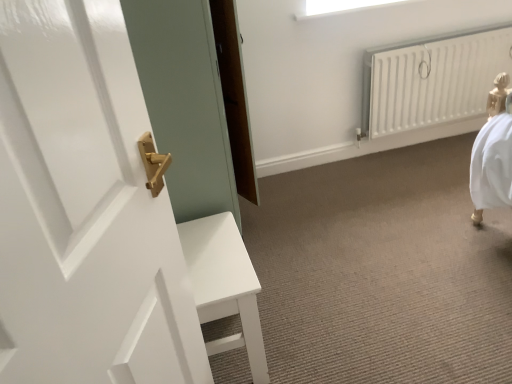
Question: From the image's perspective, is white matte radiator at upper right above or below white glossy door handle at upper left?

Choices:
 (A) above
 (B) below

Answer: (A)

Question: Would you say white matte radiator at upper right is inside or outside white glossy door handle at upper left?

Choices:
 (A) inside
 (B) outside

Answer: (B)

Question: Visually, is white matte radiator at upper right positioned to the left or to the right of white glossy door handle at upper left?

Choices:
 (A) left
 (B) right

Answer: (B)

Question: Is white glossy door handle at upper left situated inside white matte radiator at upper right or outside?

Choices:
 (A) inside
 (B) outside

Answer: (B)

Question: Is white glossy door handle at upper left wider or thinner than white matte radiator at upper right?

Choices:
 (A) thin
 (B) wide

Answer: (A)

Question: Is white glossy door handle at upper left in front of or behind white matte radiator at upper right in the image?

Choices:
 (A) front
 (B) behind

Answer: (A)

Question: Looking at the image, does white glossy door handle at upper left seem bigger or smaller compared to white matte radiator at upper right?

Choices:
 (A) small
 (B) big

Answer: (A)